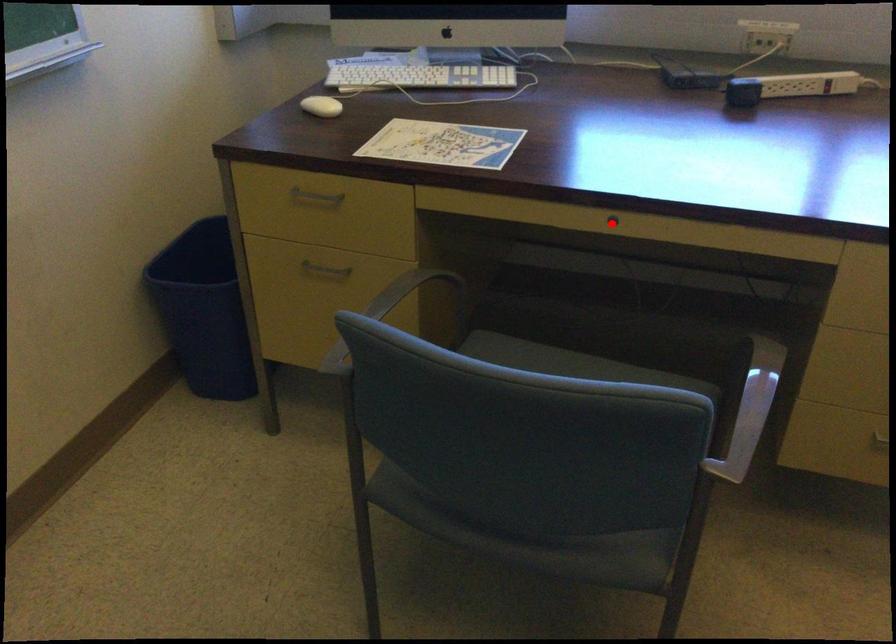
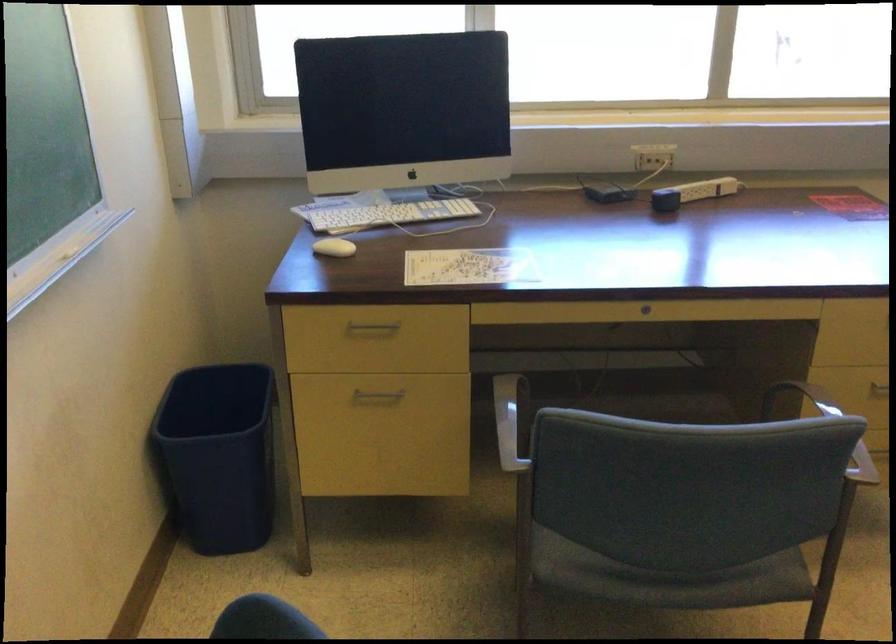
Locate, in the second image, the point that corresponds to the highlighted location in the first image.

(645, 308)